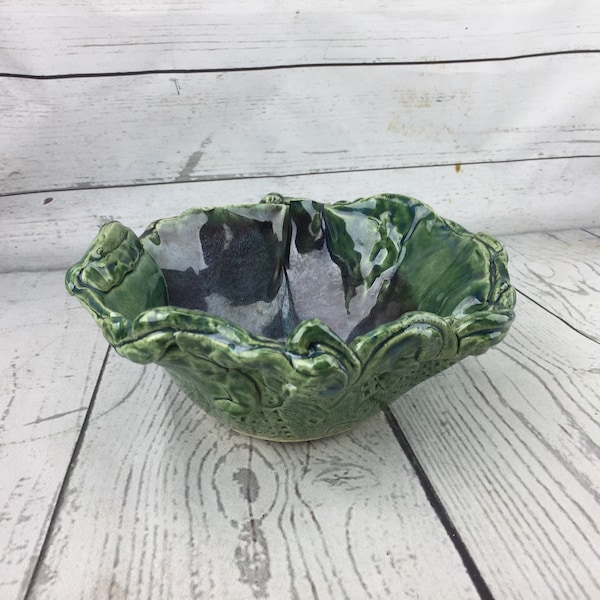
This screenshot has width=600, height=600. I want to click on empty space right of bowl, so click(545, 382).